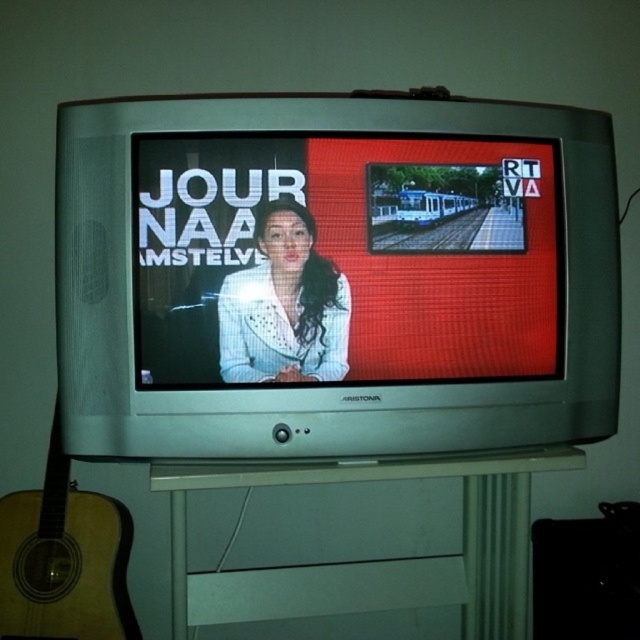
You are a delivery person who just arrived at the address and see the CRT television on the stand and the matte white jacket at center. Your task is to place the package on the nearest object to the camera. Which object should you choose?

The matte white jacket at center is 90.91 centimeters away from the camera, which is closer than the CRT television on the stand. Therefore, you should place the package on the matte white jacket at center.

You are a delivery person trying to place a large box between the matte white jacket at center and the acoustic wood guitar at left. The box is 20 inches wide. Will there be enough space between them to fit the box?

The distance between the matte white jacket at center and the acoustic wood guitar at left is 19.59 inches, which is slightly less than the box width of 20 inches. Therefore, the box will not fit between them.